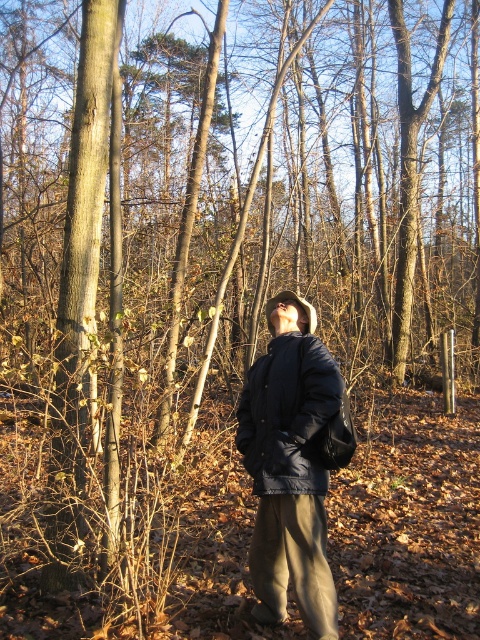
You are a photographer trying to capture both the matte black jacket at center and the navy blue quilted jacket at center in the same frame. Which jacket should you adjust your camera angle to focus on first if you want to include both in your shot?

The matte black jacket at center is positioned on the left side of the navy blue quilted jacket at center. To include both in the shot, focus on the navy blue quilted jacket at center first as it is on the right, allowing you to adjust the angle to capture the leftward positioned matte black jacket at center as well.

You are a hiker navigating through the woods and notice the matte black jacket at center and the smooth brown bark at center. Which object is closer to you as you stand in this position?

The matte black jacket at center is closer to you since it is positioned in front of the smooth brown bark at center.

Based on the photo, you are navigating through a dense forest in late autumn. You come across two points marked on a map. The first point is at coordinate point(301, 390) and the second is at point(311, 420). If you are facing north, which point would you encounter first while moving straight ahead?

Point(311, 420) would be encountered first because point(301, 390) is located behind it according to the spatial description.